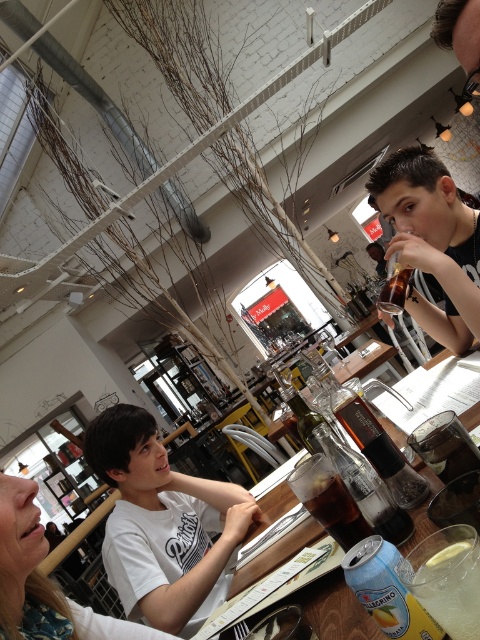
Looking at this image, you are at the cafe and want to place a small plant on the table. The plant needs to be placed exactly at point (395, 291). Which object is already occupying that spot?

The translucent glass bottle at upper right is located at point (395, 291), so that spot is already occupied by the translucent glass bottle at upper right.

You are standing in the modern cafe and want to place a 1.5 meter long tablecloth on the wooden table. The tablecloth must cover the entire table from edge to edge. Given the distance between you and the table at point (388, 280) is 1.25 meters, will the tablecloth be long enough to cover the table?

The distance between you and the table at point (388, 280) is 1.25 meters. However, the length of the tablecloth required depends on the table dimensions, not the distance from the viewer. The question cannot be answered with the provided information.

In the scene shown: You are a barista preparing drinks for customers. You notice a black matte shirt at upper right and a clear glass bottle at center on the counter. Which object has a greater width?

The black matte shirt at upper right has a greater width than the clear glass bottle at center.